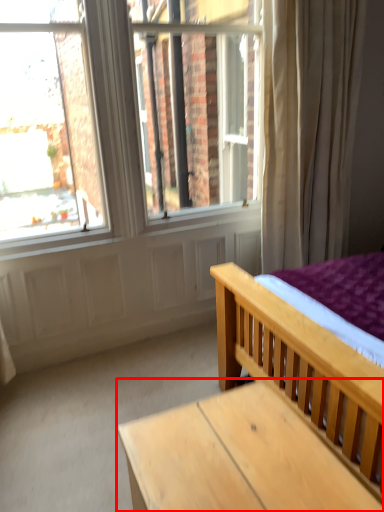
Question: Where is table (annotated by the red box) located in relation to bed in the image?

Choices:
 (A) left
 (B) right

Answer: (A)